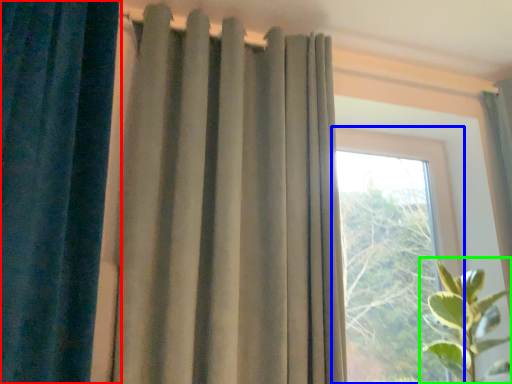
Question: Which is nearer to the curtain (highlighted by a red box)? window (highlighted by a blue box) or houseplant (highlighted by a green box).

Choices:
 (A) window
 (B) houseplant

Answer: (B)